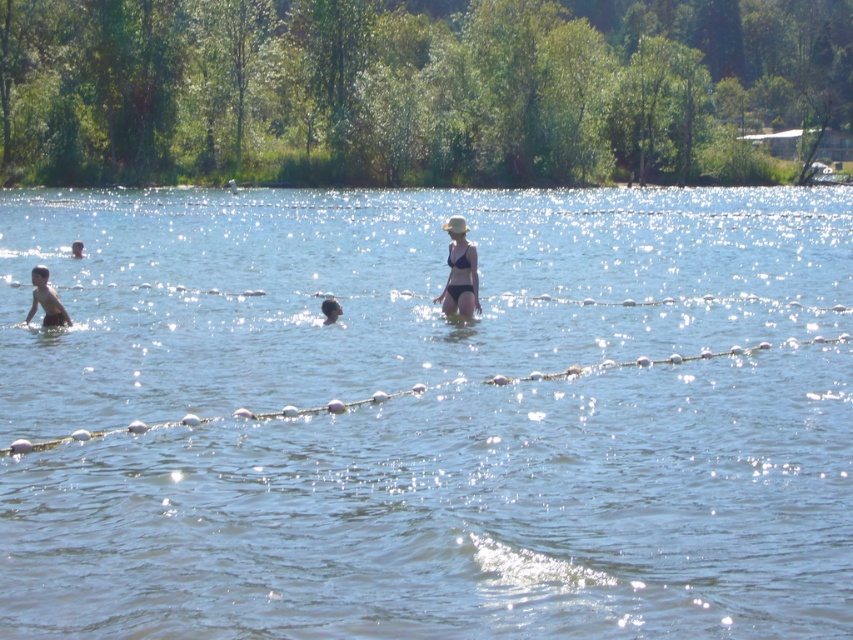
Which is behind, point (38, 296) or point (78, 241)?

Positioned behind is point (78, 241).

Does point (68, 316) lie in front of point (80, 241)?

Yes, it is.

Image resolution: width=853 pixels, height=640 pixels. In order to click on light brown skin at left in this screenshot , I will do `click(45, 300)`.

Is clear water at center bigger than dark blue swimmer at left?

Indeed, clear water at center has a larger size compared to dark blue swimmer at left.

Image resolution: width=853 pixels, height=640 pixels. Identify the location of clear water at center. (428, 417).

Who is more distant from viewer, [838,259] or [76,243]?

The point [838,259] is behind.

This screenshot has width=853, height=640. I want to click on clear water at center, so click(428, 417).

Is light brown skin at left behind dark brown hair at center?

No, it is not.

Which is behind, point (49, 323) or point (328, 321)?

The point (328, 321) is more distant.

The width and height of the screenshot is (853, 640). I want to click on light brown skin at left, so click(x=45, y=300).